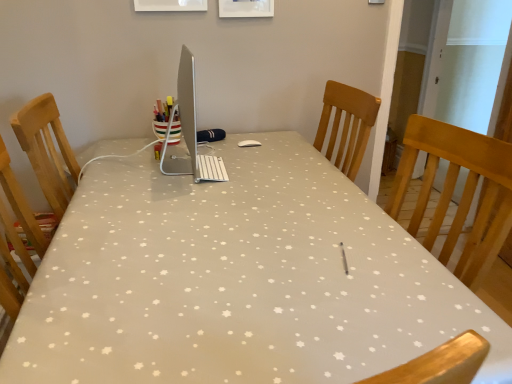
Locate an element on the screen. The height and width of the screenshot is (384, 512). vacant area to the left of sleek silver desktop at center is located at coordinates (114, 166).